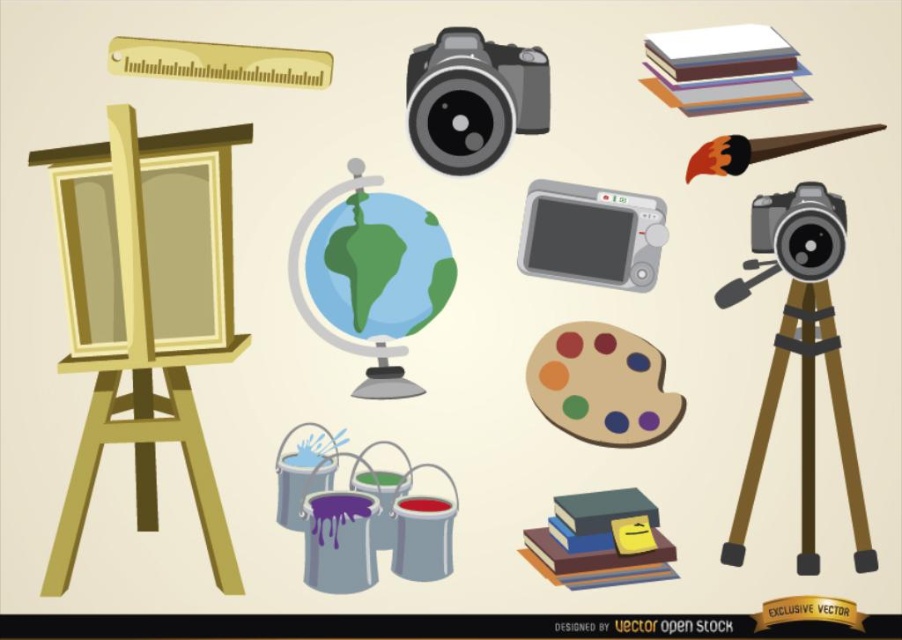
Can you confirm if brown matte tripod at right is thinner than gray plastic camera at center?

No.

Locate an element on the screen. brown matte tripod at right is located at coordinates (804, 428).

Does point (844, 460) come behind point (551, 224)?

No, (844, 460) is in front of (551, 224).

At what (x,y) coordinates should I click in order to perform the action: click on brown matte tripod at right. Please return your answer as a coordinate pair (x, y). Looking at the image, I should click on (804, 428).

Is matte plastic palette at center bigger than gray plastic camera at center?

Correct, matte plastic palette at center is larger in size than gray plastic camera at center.

Does matte plastic palette at center appear on the left side of gray plastic camera at center?

Incorrect, matte plastic palette at center is not on the left side of gray plastic camera at center.

Is point (592, 429) closer to camera compared to point (565, 202)?

Yes, it is.

At what (x,y) coordinates should I click in order to perform the action: click on matte plastic palette at center. Please return your answer as a coordinate pair (x, y). Looking at the image, I should click on (603, 385).

The height and width of the screenshot is (640, 902). I want to click on wooden easel at left, so pos(145,310).

Is point (111, 364) positioned before point (474, 38)?

Yes, it is.

Where is `wooden easel at left`? The height and width of the screenshot is (640, 902). wooden easel at left is located at coordinates (145, 310).